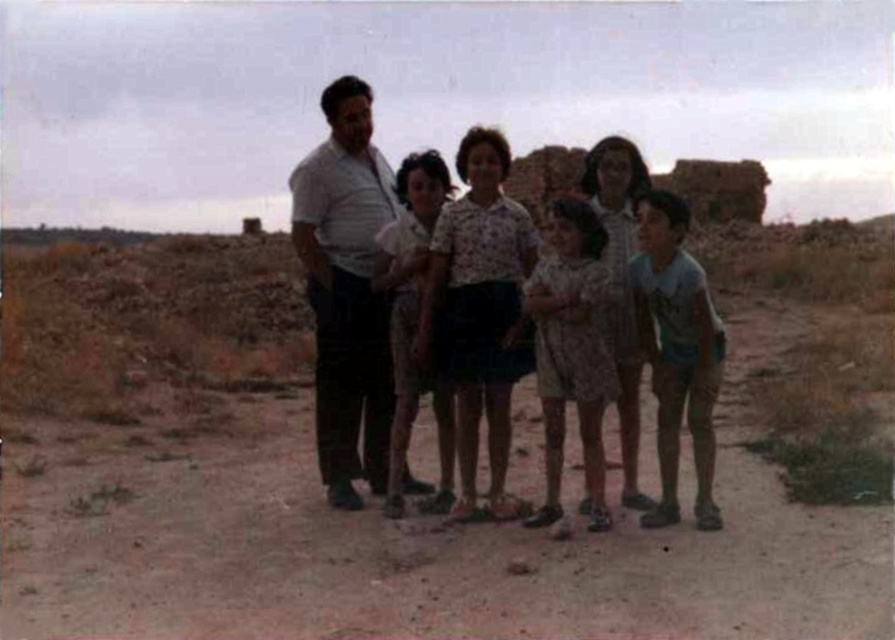
Question: Does blue cotton shirt at right appear over light pink floral dress at center?

Choices:
 (A) yes
 (B) no

Answer: (B)

Question: Which of the following is the closest to the observer?

Choices:
 (A) coord(360,172)
 (B) coord(599,262)
 (C) coord(672,298)

Answer: (C)

Question: Which of these objects is positioned farthest from the blue cotton shirt at right?

Choices:
 (A) striped cotton shirt at center
 (B) dotted fabric dress at center
 (C) light pink floral dress at center
 (D) white cotton shirt at center

Answer: (A)

Question: In this image, where is white cotton shirt at center located relative to blue cotton shirt at right?

Choices:
 (A) right
 (B) left

Answer: (B)

Question: Does striped cotton shirt at center lie in front of dotted fabric dress at center?

Choices:
 (A) no
 (B) yes

Answer: (A)

Question: Which object is farther from the camera taking this photo?

Choices:
 (A) light pink floral dress at center
 (B) dotted fabric dress at center

Answer: (A)